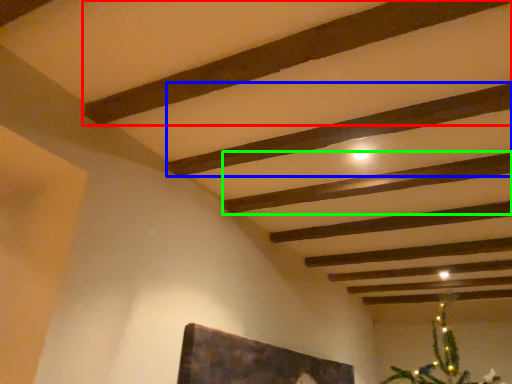
Question: Which is nearer to the plank (highlighted by a red box)? plank (highlighted by a blue box) or plank (highlighted by a green box).

Choices:
 (A) plank
 (B) plank

Answer: (A)